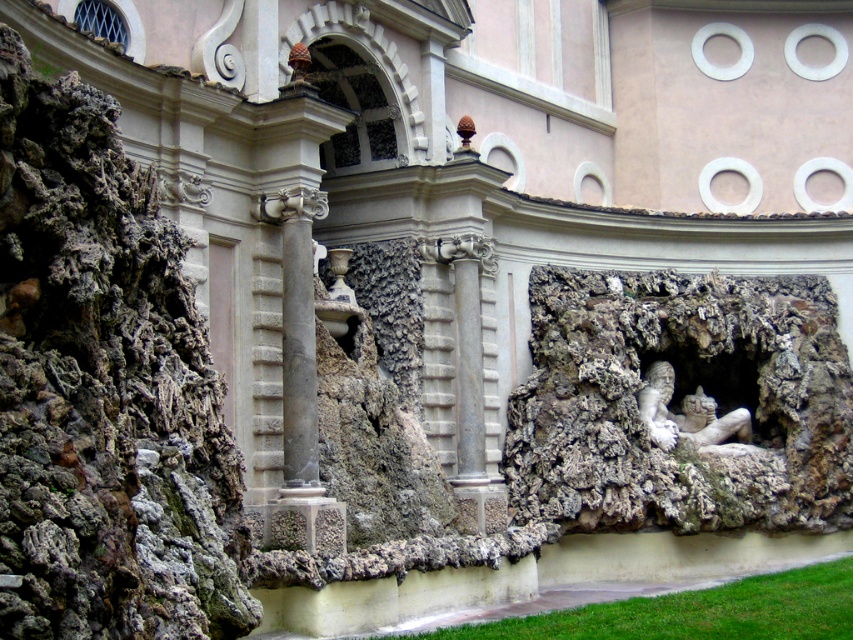
Question: Which point is closer to the camera?

Choices:
 (A) (659, 413)
 (B) (553, 499)

Answer: (B)

Question: Is rough stone rock at center to the left of rough stone carving at center from the viewer's perspective?

Choices:
 (A) yes
 (B) no

Answer: (A)

Question: Can you confirm if rough stone rock at center is wider than rough stone carving at center?

Choices:
 (A) no
 (B) yes

Answer: (A)

Question: Does rough stone carving at center appear on the left side of white stone reclining figure at center-right?

Choices:
 (A) no
 (B) yes

Answer: (B)

Question: Estimate the real-world distances between objects in this image. Which object is closer to the rough stone rock at center?

Choices:
 (A) rough stone carving at center
 (B) white stone reclining figure at center-right

Answer: (A)

Question: Which point is farther from the camera taking this photo?

Choices:
 (A) (663, 406)
 (B) (717, 289)

Answer: (B)